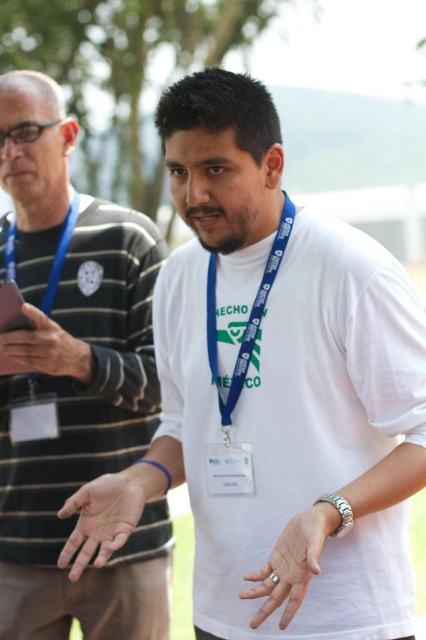
Does smooth skin hand at center appear on the right side of blue fabric lanyard at center?

In fact, smooth skin hand at center is to the left of blue fabric lanyard at center.

Who is taller, smooth skin hand at center or blue fabric lanyard at center?

With more height is blue fabric lanyard at center.

Who is more forward, (98,508) or (215,282)?

Point (98,508)

In order to click on smooth skin hand at center in this screenshot , I will do `click(106, 515)`.

Which is more to the right, silver metallic ring at center or matte blue lanyard at upper left?

Positioned to the right is silver metallic ring at center.

Is silver metallic ring at center shorter than matte blue lanyard at upper left?

No, silver metallic ring at center is not shorter than matte blue lanyard at upper left.

Who is more distant from viewer, [256,621] or [31,184]?

The point [31,184] is more distant.

Identify the location of silver metallic ring at center. The width and height of the screenshot is (426, 640). (291, 563).

Can you confirm if silver metallic ring at center is smaller than matte white neck at center?

Actually, silver metallic ring at center might be larger than matte white neck at center.

Is silver metallic ring at center above matte white neck at center?

Actually, silver metallic ring at center is below matte white neck at center.

At what (x,y) coordinates should I click in order to perform the action: click on silver metallic ring at center. Please return your answer as a coordinate pair (x, y). This screenshot has height=640, width=426. Looking at the image, I should click on (291, 563).